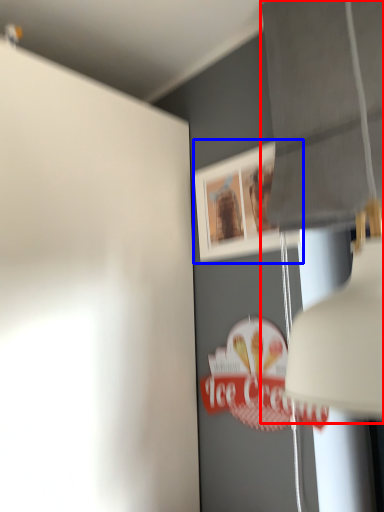
Question: Which of the following is the farthest to the observer, lamp (highlighted by a red box) or picture frame (highlighted by a blue box)?

Choices:
 (A) lamp
 (B) picture frame

Answer: (B)